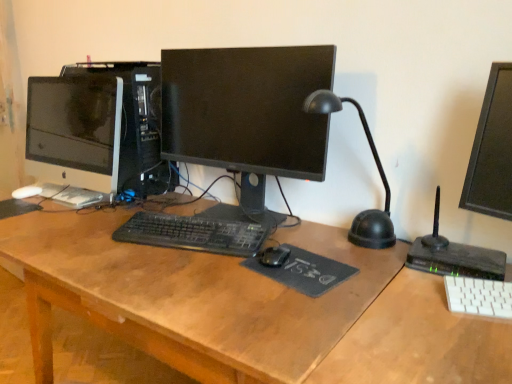
The height and width of the screenshot is (384, 512). What are the coordinates of `vacant space that's between black matte keyboard at center, the 1th computer keyboard when ordered from top to bottom, and black matte mouse at center` in the screenshot? It's located at (196, 250).